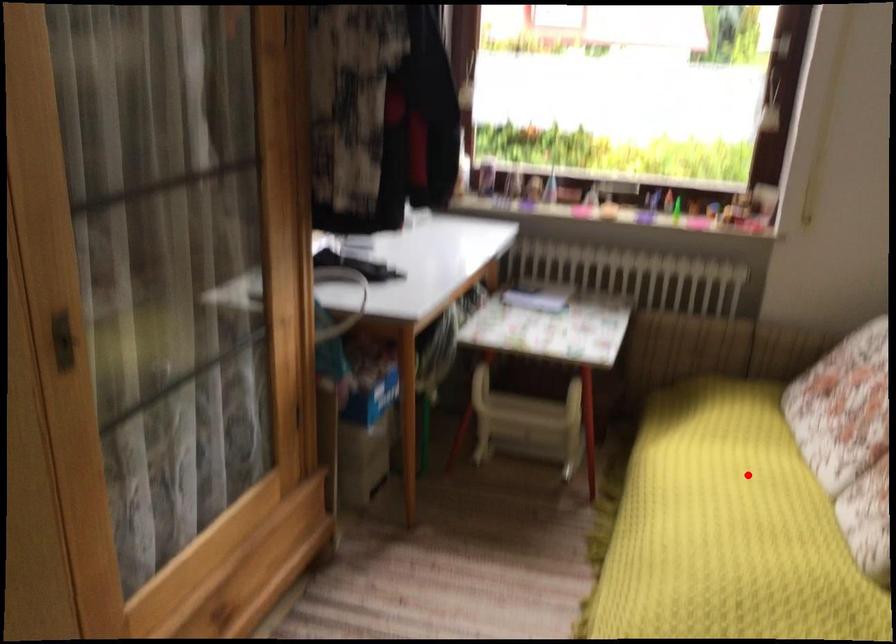
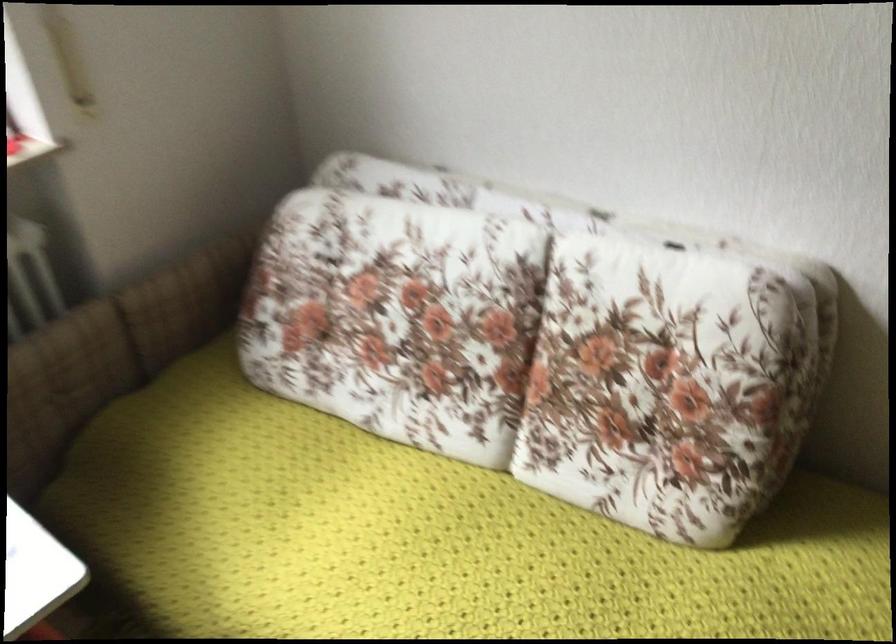
The point at the highlighted location is marked in the first image. Where is the corresponding point in the second image?

(429, 538)